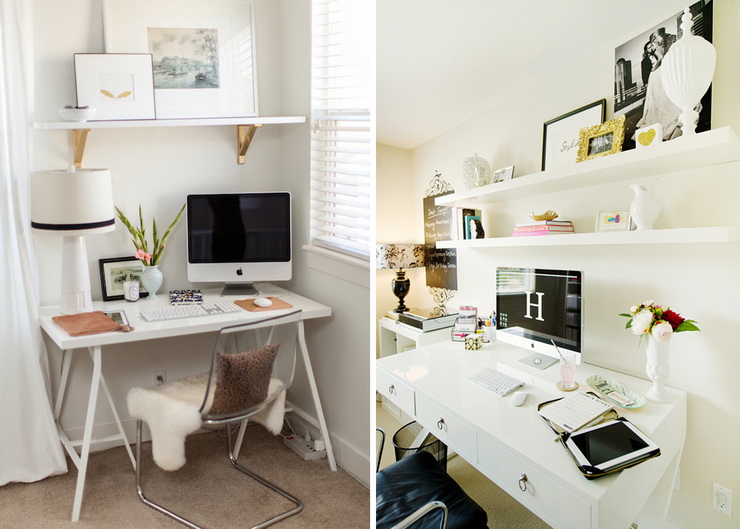
Find the location of `floor`. floor is located at coordinates coord(107,513), coord(508,499).